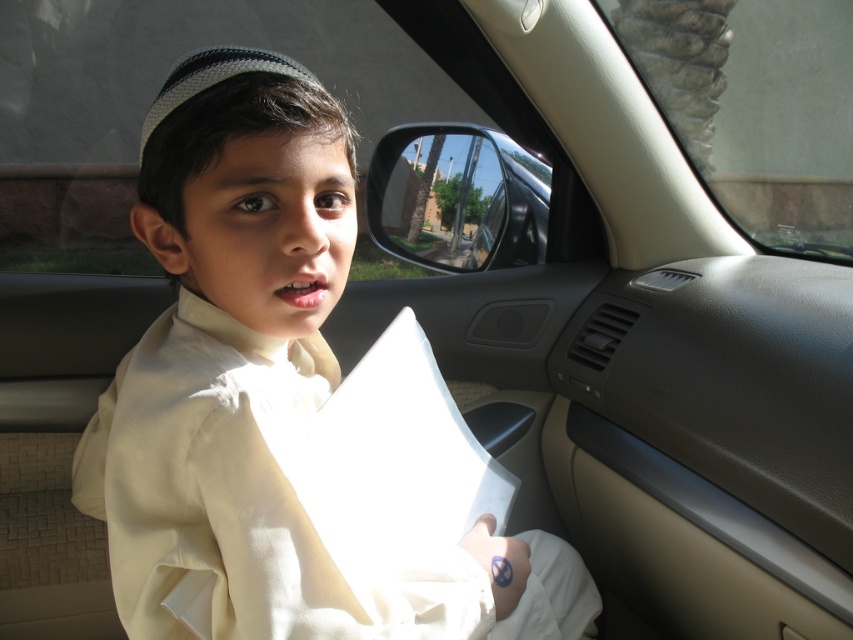
You are a passenger in a car and want to check your reflection in the transparent glass mirror at center. However, there is a white cotton robe at center blocking your view. Can you see your reflection through the mirror?

The white cotton robe at center is in front of the transparent glass mirror at center, so it is blocking the mirror. Therefore, you cannot see your reflection through the transparent glass mirror at center unless you move the robe out of the way.

Based on the scene description, which object takes up more space in the image? Please choose between the white cotton robe at center and the transparent glass car window at upper right.

The transparent glass car window at upper right takes up more space in the image than the white cotton robe at center because the white cotton robe at center occupies less space than transparent glass car window at upper right.

Based on the scene described, which object is positioned to the right of the other between the transparent glass car window at upper right and the transparent glass mirror at center?

The transparent glass car window at upper right is positioned to the right of the transparent glass mirror at center.